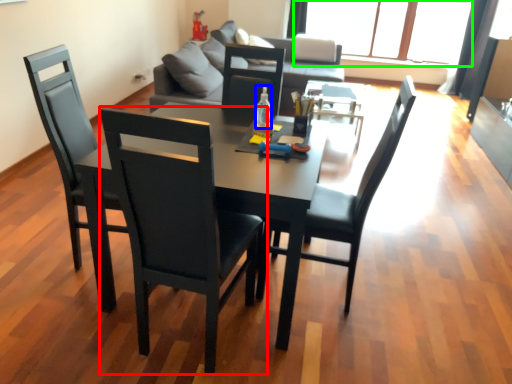
Question: Considering the real-world distances, which object is farthest from chair (highlighted by a red box)? bottle (highlighted by a blue box) or window (highlighted by a green box)?

Choices:
 (A) bottle
 (B) window

Answer: (B)